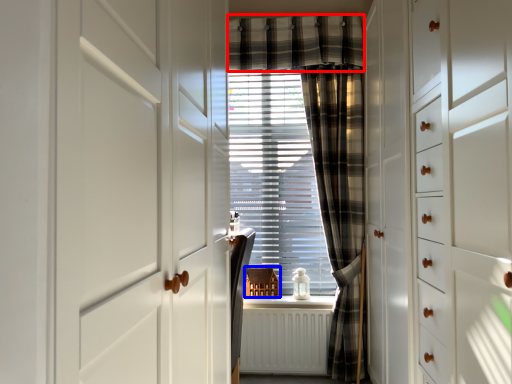
Question: Which object appears closest to the camera in this image, plaid (highlighted by a red box) or furniture (highlighted by a blue box)?

Choices:
 (A) plaid
 (B) furniture

Answer: (A)